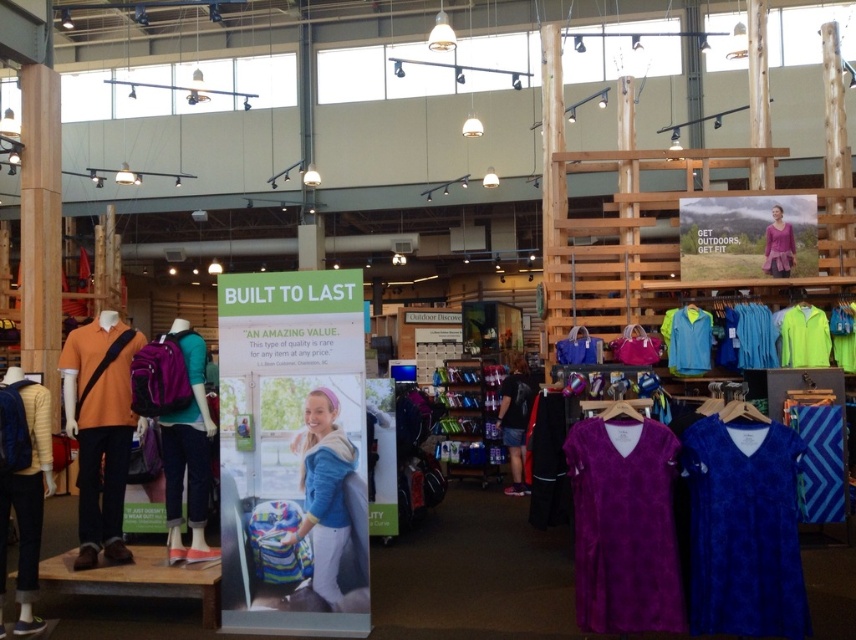
Question: Which object is the closest to the orange matte polo shirt at left?

Choices:
 (A) light blue fabric shirt at upper right
 (B) blue velour shirt at lower right
 (C) blue fabric shirt at center

Answer: (B)

Question: Can you confirm if dark blue jeans at center is wider than velvet purple dress at center?

Choices:
 (A) yes
 (B) no

Answer: (A)

Question: Is the position of blue velour shirt at lower right less distant than that of light blue fabric shirt at upper right?

Choices:
 (A) no
 (B) yes

Answer: (B)

Question: Which point appears farthest from the camera in this image?

Choices:
 (A) (4, 490)
 (B) (444, 369)

Answer: (B)

Question: Which object is the closest to the blue fabric shirt at center?

Choices:
 (A) purple fleece top at upper right
 (B) metallic silver shoe rack at center
 (C) orange matte polo shirt at left

Answer: (A)

Question: Does purple fabric backpack at center lie behind velvet purple dress at center?

Choices:
 (A) yes
 (B) no

Answer: (B)